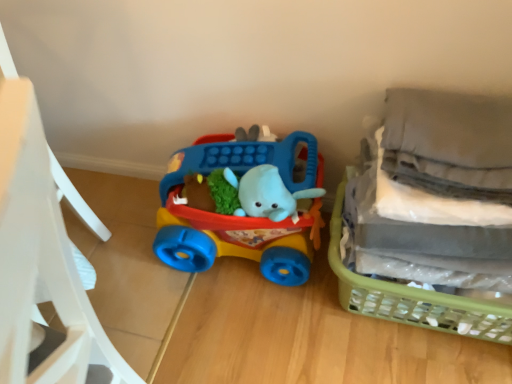
Question: Looking at the image, does matte plastic toy car at center seem bigger or smaller compared to matte plastic chair at left?

Choices:
 (A) small
 (B) big

Answer: (A)

Question: Does point (244, 254) appear closer or farther from the camera than point (15, 180)?

Choices:
 (A) farther
 (B) closer

Answer: (A)

Question: Considering the real-world distances, which object is farthest from the matte plastic toy car at center?

Choices:
 (A) matte plastic chair at left
 (B) green plastic basket at right

Answer: (A)

Question: Which object is positioned farthest from the matte plastic toy car at center?

Choices:
 (A) matte plastic chair at left
 (B) green plastic basket at right

Answer: (A)